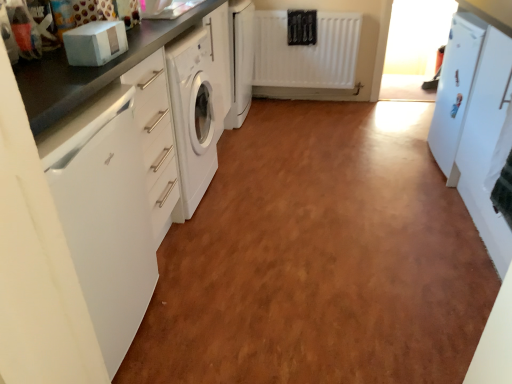
Question: Is white glossy refrigerator at right turned away from white glossy washing machine at center, the second cabinetry when ordered from front to back?

Choices:
 (A) yes
 (B) no

Answer: (B)

Question: Is white glossy refrigerator at right to the right of white glossy washing machine at center, acting as the 1th cabinetry starting from the left, from the viewer's perspective?

Choices:
 (A) no
 (B) yes

Answer: (B)

Question: From the image's perspective, would you say white glossy refrigerator at right is positioned over white glossy washing machine at center, positioned as the 1th cabinetry in top-to-bottom order?

Choices:
 (A) no
 (B) yes

Answer: (A)

Question: From a real-world perspective, is white glossy refrigerator at right located higher than white glossy washing machine at center, the second cabinetry in the right-to-left sequence?

Choices:
 (A) yes
 (B) no

Answer: (A)

Question: Considering the relative sizes of white glossy refrigerator at right and white glossy washing machine at center, which appears as the second cabinetry when ordered from the bottom, in the image provided, is white glossy refrigerator at right bigger than white glossy washing machine at center, which appears as the second cabinetry when ordered from the bottom,?

Choices:
 (A) no
 (B) yes

Answer: (B)

Question: Is white glossy refrigerator at right wider than white glossy washing machine at center, positioned as the 1th cabinetry in top-to-bottom order?

Choices:
 (A) yes
 (B) no

Answer: (A)

Question: Is matte black countertop at left far away from white matte refrigerator at right, arranged as the 1th cabinetry when viewed from the front?

Choices:
 (A) no
 (B) yes

Answer: (B)

Question: Does matte black countertop at left have a greater width compared to white matte refrigerator at right, acting as the second cabinetry starting from the left?

Choices:
 (A) no
 (B) yes

Answer: (B)

Question: Is matte black countertop at left shorter than white matte refrigerator at right, which appears as the second cabinetry when viewed from the back?

Choices:
 (A) yes
 (B) no

Answer: (B)

Question: From a real-world perspective, does matte black countertop at left stand above white matte refrigerator at right, arranged as the 1th cabinetry when ordered from the bottom?

Choices:
 (A) no
 (B) yes

Answer: (A)

Question: From the image's perspective, does matte black countertop at left appear higher than white matte refrigerator at right, arranged as the 1th cabinetry when ordered from the bottom?

Choices:
 (A) no
 (B) yes

Answer: (B)

Question: Is matte black countertop at left taller than white matte refrigerator at right, arranged as the 1th cabinetry when ordered from the bottom?

Choices:
 (A) yes
 (B) no

Answer: (A)

Question: From the image's perspective, is white matte refrigerator at right, which appears as the second cabinetry when viewed from the back, over white glossy countertop at left?

Choices:
 (A) no
 (B) yes

Answer: (B)